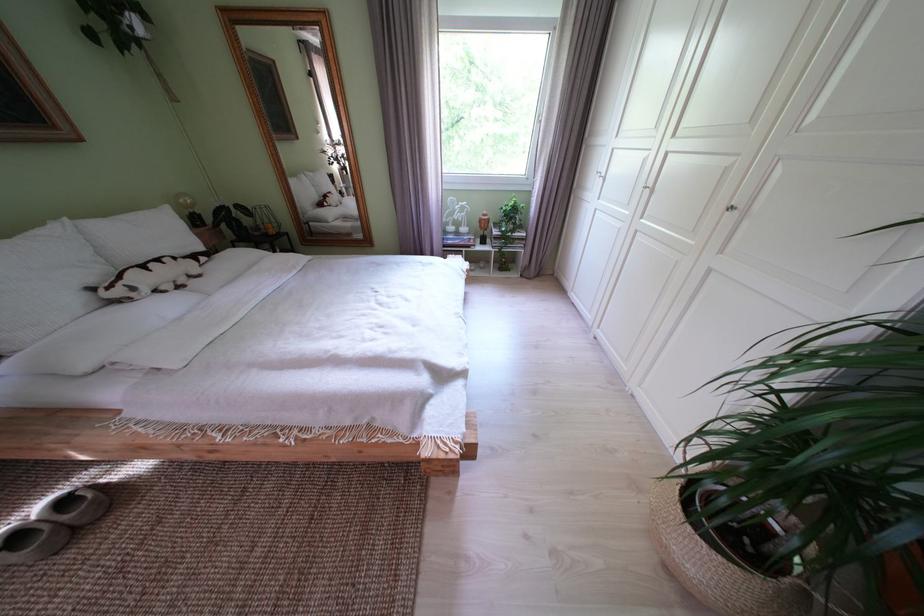
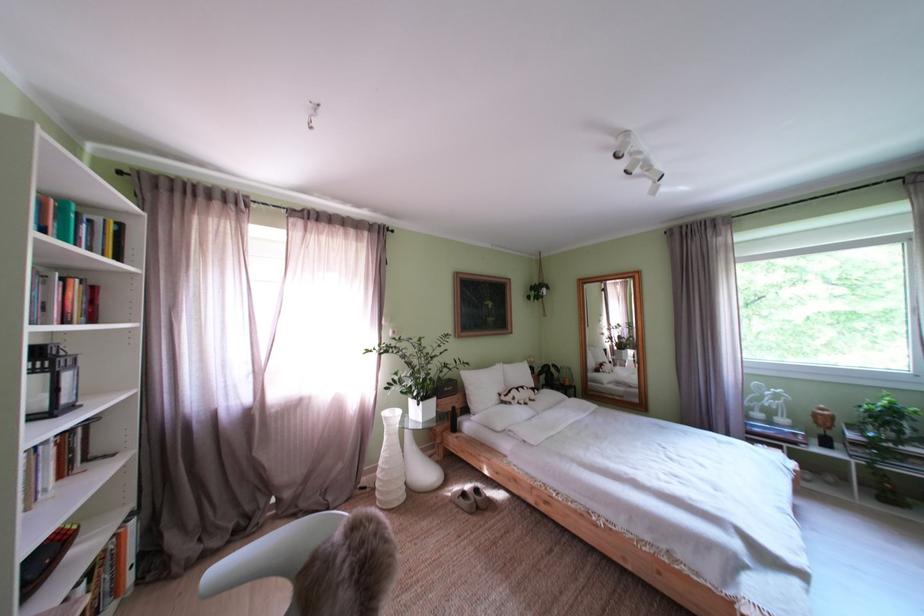
In the second image, find the point that corresponds to (492,225) in the first image.

(825, 419)